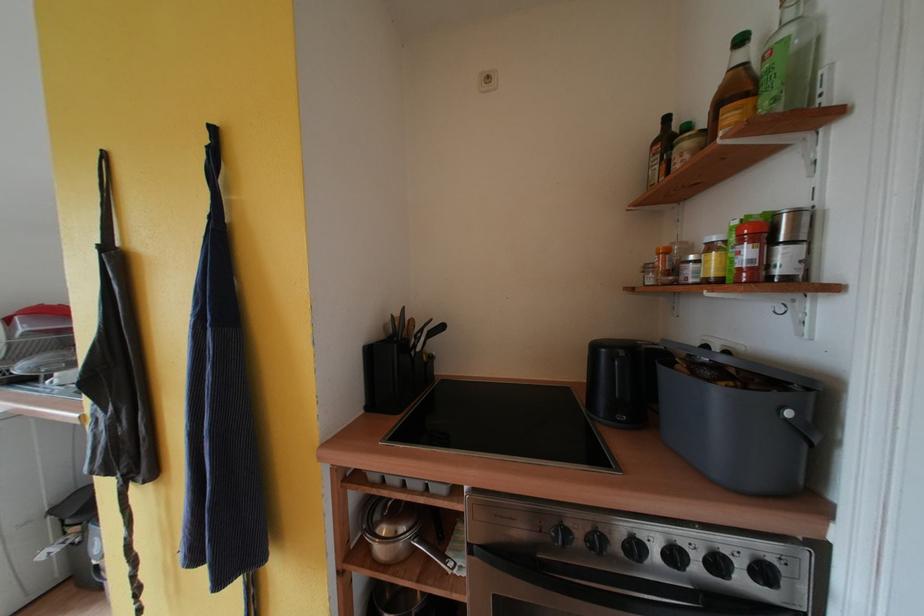
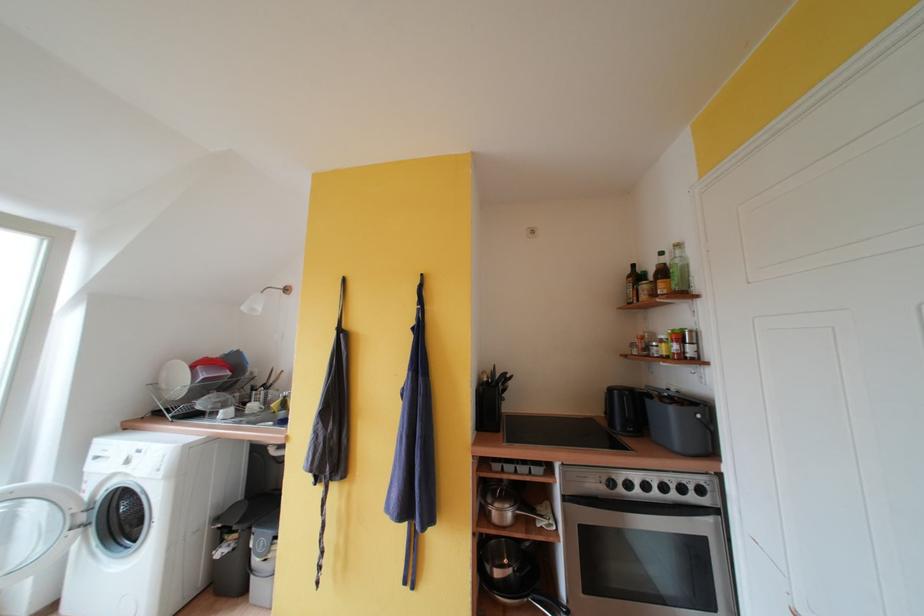
Locate, in the second image, the point that corresponds to point 723,397 in the first image.

(678, 413)